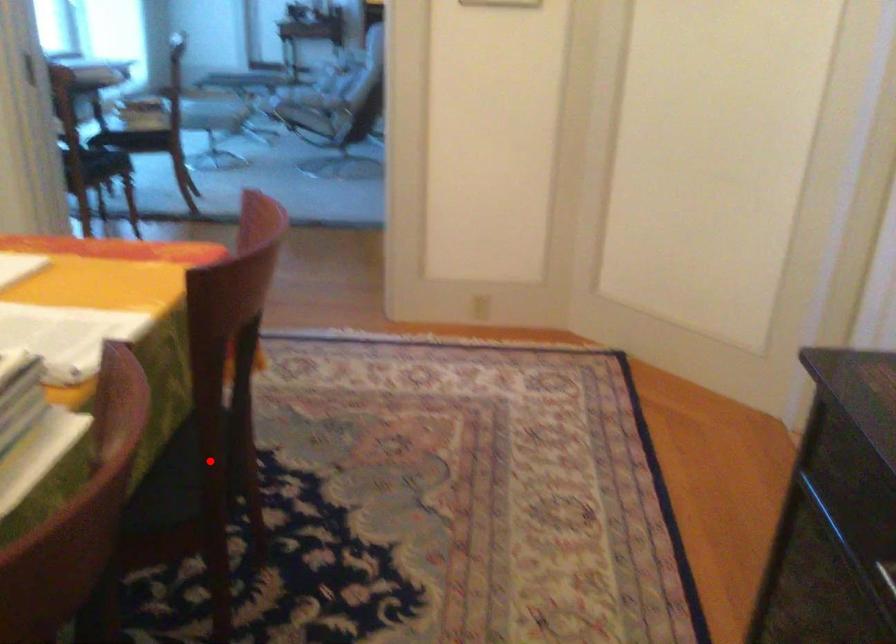
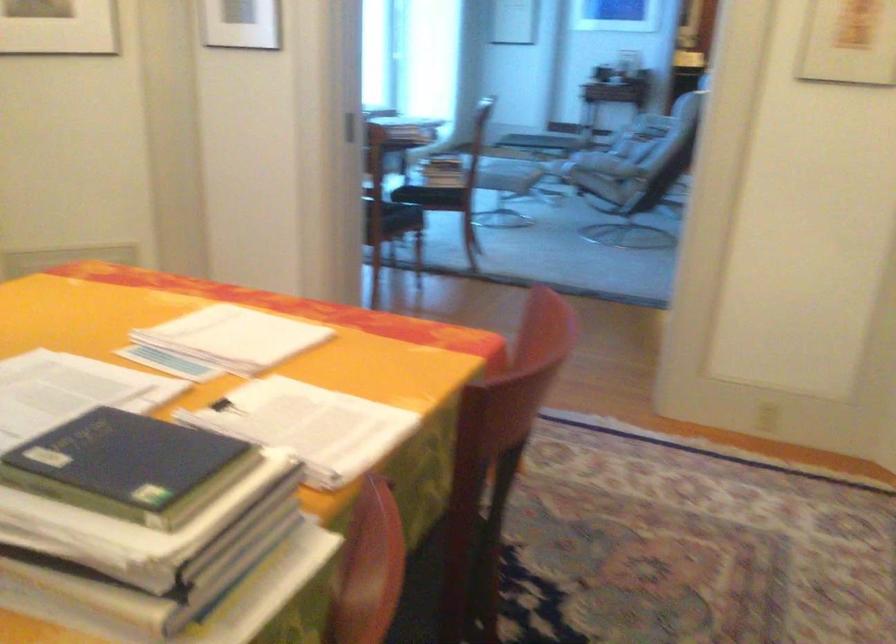
Question: I am providing you with two images of the same scene from different viewpoints. In image1, a red point is highlighted. Considering the same 3D point in image2, which of the following is correct?

Choices:
 (A) It is closer
 (B) It is farther

Answer: (A)